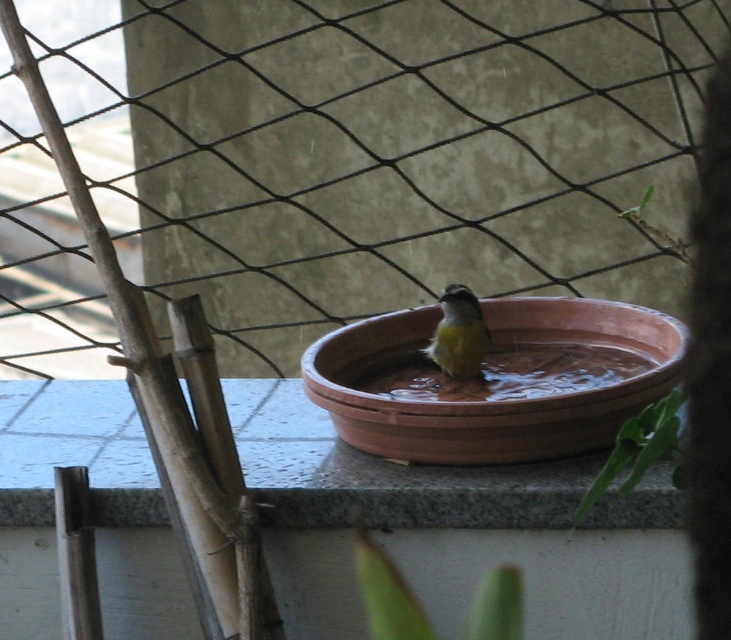
Question: Which point is closer to the camera?

Choices:
 (A) [501, 444]
 (B) [481, 346]

Answer: (A)

Question: Which point is farther to the camera?

Choices:
 (A) green leafy plant at lower center
 (B) green leafy plant at lower right
 (C) granite stone window sill at center

Answer: (A)

Question: Which object appears farthest from the camera in this image?

Choices:
 (A) granite stone window sill at center
 (B) green leafy plant at lower center
 (C) yellow matte bird at center
 (D) terracotta clay bird bath at center

Answer: (C)

Question: Considering the relative positions of granite stone window sill at center and clear water at center in the image provided, where is granite stone window sill at center located with respect to clear water at center?

Choices:
 (A) right
 (B) left

Answer: (B)

Question: Can you confirm if granite stone window sill at center is positioned below green leafy plant at lower center?

Choices:
 (A) yes
 (B) no

Answer: (B)

Question: Does granite stone window sill at center appear over green leafy plant at lower center?

Choices:
 (A) no
 (B) yes

Answer: (B)